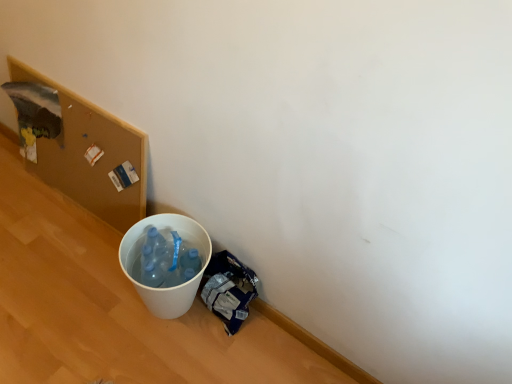
Question: Is wooden corkboard at upper left situated inside blue plastic bag at lower right or outside?

Choices:
 (A) inside
 (B) outside

Answer: (B)

Question: Based on their sizes in the image, would you say wooden corkboard at upper left is bigger or smaller than blue plastic bag at lower right?

Choices:
 (A) big
 (B) small

Answer: (A)

Question: Estimate the real-world distances between objects in this image. Which object is farther from the blue plastic bag at lower right?

Choices:
 (A) wooden corkboard at upper left
 (B) white plastic bucket at lower left

Answer: (A)

Question: Considering the real-world distances, which object is farthest from the blue plastic bag at lower right?

Choices:
 (A) white plastic bucket at lower left
 (B) wooden corkboard at upper left

Answer: (B)